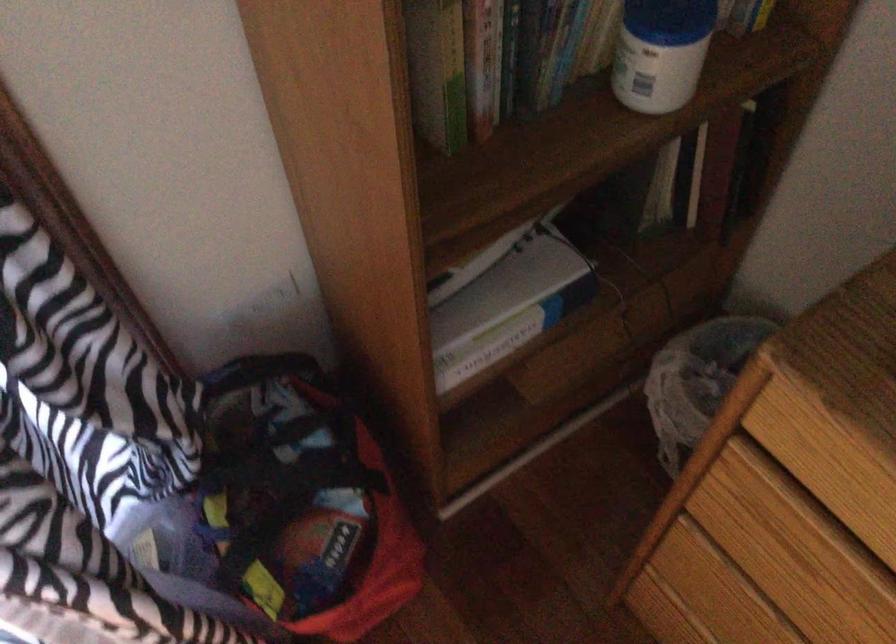
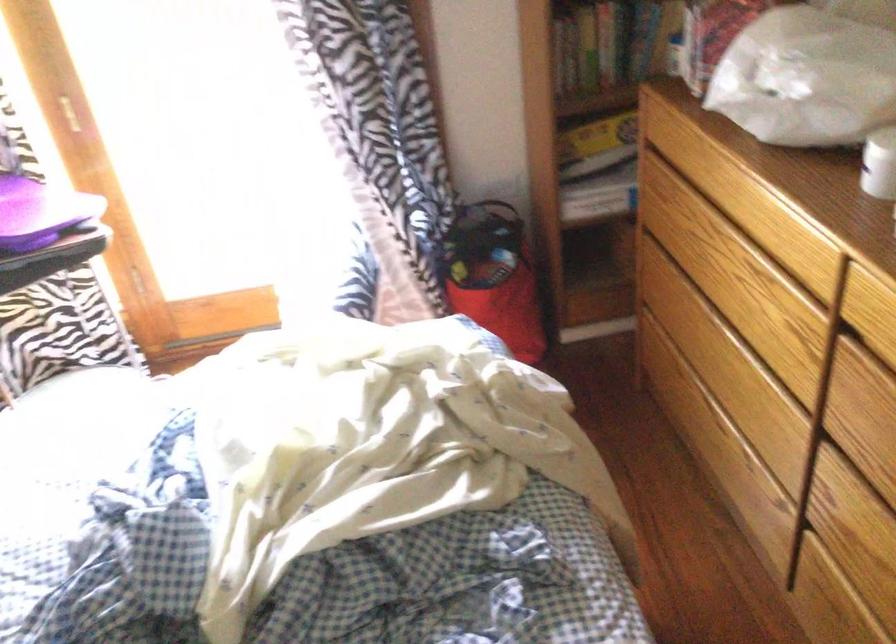
Where in the second image is the point corresponding to pixel 497 90 from the first image?

(606, 44)